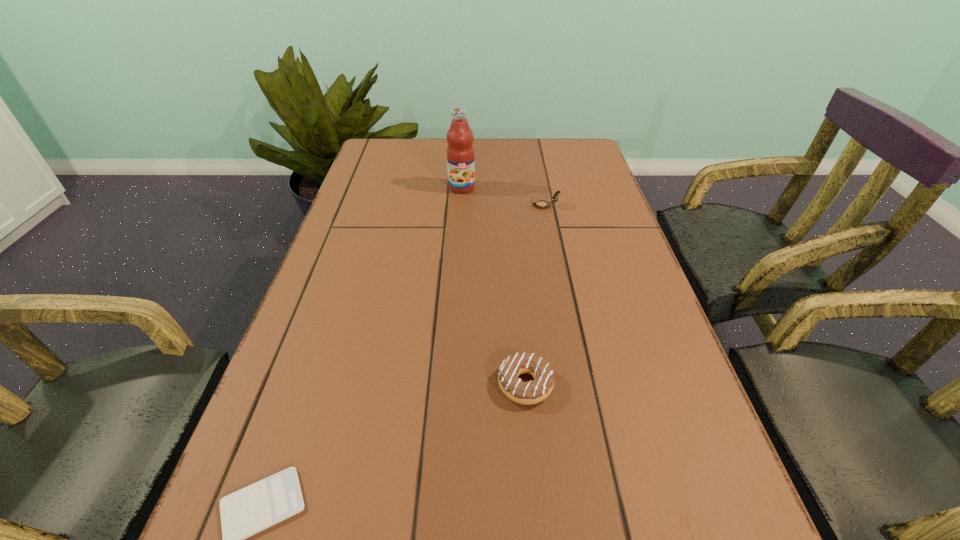
This screenshot has height=540, width=960. Identify the location of vacant region located 0.110m on the back of the second object from right to left. (519, 319).

The height and width of the screenshot is (540, 960). In order to click on object positioned at the right edge in this screenshot , I will do `click(541, 204)`.

The height and width of the screenshot is (540, 960). What are the coordinates of `free space at the far edge` in the screenshot? It's located at (519, 148).

Find the location of a particular element. The height and width of the screenshot is (540, 960). blank space at the left edge of the desktop is located at coordinates (404, 198).

Find the location of a particular element. vacant space at the right edge of the desktop is located at coordinates (632, 511).

In order to click on vacant space at the far left corner of the desktop in this screenshot , I will do `click(393, 141)`.

In the image, there is a desktop. Identify the location of vacant space at the far right corner. (585, 149).

Where is `vacant area that lies between the second farthest object and the tallest object`? The width and height of the screenshot is (960, 540). vacant area that lies between the second farthest object and the tallest object is located at coordinates (503, 197).

Where is `free space between the second object from left to right and the rightmost object`? Image resolution: width=960 pixels, height=540 pixels. free space between the second object from left to right and the rightmost object is located at coordinates (503, 197).

The height and width of the screenshot is (540, 960). In order to click on free spot between the doughnut and the farthest object in this screenshot , I will do `click(493, 286)`.